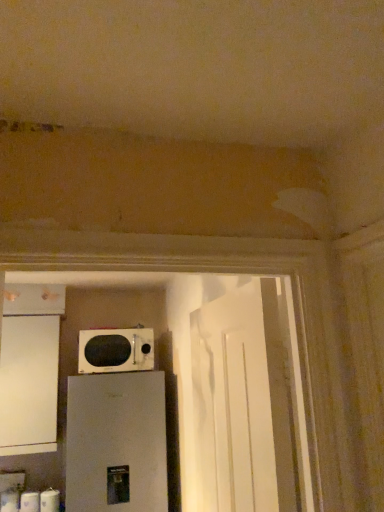
Describe the element at coordinates (30, 368) in the screenshot. This screenshot has width=384, height=512. I see `white matte cabinet at left` at that location.

Identify the location of white matte cabinet at left. This screenshot has height=512, width=384. (30, 368).

What is the approximate height of white matte toilet paper at lower left, the 2th toilet paper in the right-to-left sequence?

white matte toilet paper at lower left, the 2th toilet paper in the right-to-left sequence, is 5.62 inches tall.

Measure the distance between white matte toilet paper at lower left, the 2th toilet paper in the right-to-left sequence, and camera.

They are 2.51 meters apart.

I want to click on white glossy door at center, so click(x=242, y=405).

What are the coordinates of `white matte cabinet at left` in the screenshot? It's located at (30, 368).

Is white matte toilet paper at lower left, which is the second toilet paper in left-to-right order, far away from white glossy door at center?

white matte toilet paper at lower left, which is the second toilet paper in left-to-right order, is positioned a significant distance from white glossy door at center.

Is white matte toilet paper at lower left, the 2th toilet paper in the right-to-left sequence, wider or thinner than white glossy door at center?

In the image, white matte toilet paper at lower left, the 2th toilet paper in the right-to-left sequence, appears to be more narrow than white glossy door at center.

From the image's perspective, which one is positioned higher, white matte toilet paper at lower left, which is the second toilet paper in left-to-right order, or white glossy door at center?

white glossy door at center is shown above in the image.

Does point (30, 499) lie behind point (264, 300)?

Yes, it is.

How different are the orientations of white matte toilet paper at lower left, which is counted as the 1th toilet paper, starting from the right, and white glossy microwave at center in degrees?

white matte toilet paper at lower left, which is counted as the 1th toilet paper, starting from the right, and white glossy microwave at center are facing 9.36 degrees away from each other.

From a real-world perspective, is white matte toilet paper at lower left, which is counted as the 1th toilet paper, starting from the right, under white glossy microwave at center?

Yes, from a real-world perspective, white matte toilet paper at lower left, which is counted as the 1th toilet paper, starting from the right, is beneath white glossy microwave at center.

Is white matte toilet paper at lower left, which is counted as the 1th toilet paper, starting from the right, positioned beyond the bounds of white glossy microwave at center?

Yes, white matte toilet paper at lower left, which is counted as the 1th toilet paper, starting from the right, is located beyond the bounds of white glossy microwave at center.

Is point (57, 492) closer to viewer compared to point (82, 343)?

Yes, it is in front of point (82, 343).

Who is shorter, white matte refrigerator at lower left or white matte toilet paper at lower left, which ranks as the third toilet paper in right-to-left order?

white matte toilet paper at lower left, which ranks as the third toilet paper in right-to-left order, is shorter.

Does white matte refrigerator at lower left have a smaller size compared to white matte toilet paper at lower left, which ranks as the third toilet paper in right-to-left order?

No, white matte refrigerator at lower left is not smaller than white matte toilet paper at lower left, which ranks as the third toilet paper in right-to-left order.

From the image's perspective, who appears lower, white matte refrigerator at lower left or white matte toilet paper at lower left, which is counted as the 1th toilet paper, starting from the left?

From the image's view, white matte toilet paper at lower left, which is counted as the 1th toilet paper, starting from the left, is below.

From the image's perspective, which object appears higher, white matte toilet paper at lower left, the 2th toilet paper in the right-to-left sequence, or white matte toilet paper at lower left, which ranks as the third toilet paper in right-to-left order?

white matte toilet paper at lower left, the 2th toilet paper in the right-to-left sequence.

The image size is (384, 512). What are the coordinates of `toilet paper that is the 2nd one above the white matte toilet paper at lower left, which is the second toilet paper in left-to-right order (from a real-world perspective)` in the screenshot? It's located at (10, 500).

Looking at this image, is white matte toilet paper at lower left, which is the second toilet paper in left-to-right order, facing away from white matte toilet paper at lower left, which ranks as the third toilet paper in right-to-left order?

white matte toilet paper at lower left, which is the second toilet paper in left-to-right order, is not turned away from white matte toilet paper at lower left, which ranks as the third toilet paper in right-to-left order.

Considering the positions of points (6, 340) and (263, 478), is point (6, 340) closer to camera compared to point (263, 478)?

No.

Is white matte cabinet at left aimed at white glossy door at center?

No, white matte cabinet at left is not aimed at white glossy door at center.

From a real-world perspective, relative to white glossy door at center, is white matte cabinet at left vertically above or below?

white matte cabinet at left is situated higher than white glossy door at center in the real world.

From the image's perspective, is white matte cabinet at left below white glossy door at center?

Yes, from the image's perspective, white matte cabinet at left is below white glossy door at center.

From the picture: Are white matte toilet paper at lower left, which is counted as the 1th toilet paper, starting from the right, and white matte cabinet at left making contact?

No, white matte toilet paper at lower left, which is counted as the 1th toilet paper, starting from the right, is not making contact with white matte cabinet at left.

Does point (41, 500) come in front of point (6, 441)?

No.

Is white matte toilet paper at lower left, positioned as the 3th toilet paper in left-to-right order, shorter than white matte cabinet at left?

Correct, white matte toilet paper at lower left, positioned as the 3th toilet paper in left-to-right order, is not as tall as white matte cabinet at left.

From a real-world perspective, which is physically above, white matte toilet paper at lower left, positioned as the 3th toilet paper in left-to-right order, or white matte cabinet at left?

In real-world perspective, white matte cabinet at left is above.

Can you see white glossy microwave at center touching white matte toilet paper at lower left, which is counted as the 1th toilet paper, starting from the left?

No, white glossy microwave at center is not with white matte toilet paper at lower left, which is counted as the 1th toilet paper, starting from the left.

Between white glossy microwave at center and white matte toilet paper at lower left, which ranks as the third toilet paper in right-to-left order, which one has larger size?

Bigger between the two is white glossy microwave at center.

From the image's perspective, is white glossy microwave at center over white matte toilet paper at lower left, which is counted as the 1th toilet paper, starting from the left?

Yes, from the image's perspective, white glossy microwave at center is on top of white matte toilet paper at lower left, which is counted as the 1th toilet paper, starting from the left.

Is white matte toilet paper at lower left, which ranks as the third toilet paper in right-to-left order, inside white glossy microwave at center?

Actually, white matte toilet paper at lower left, which ranks as the third toilet paper in right-to-left order, is outside white glossy microwave at center.

Where is `door located on the right of white matte toilet paper at lower left, which is the second toilet paper in left-to-right order`? door located on the right of white matte toilet paper at lower left, which is the second toilet paper in left-to-right order is located at coordinates (242, 405).

The width and height of the screenshot is (384, 512). In order to click on microwave oven that appears above the white matte toilet paper at lower left, positioned as the 3th toilet paper in left-to-right order (from the image's perspective) in this screenshot , I will do `click(115, 350)`.

When comparing their distances from white matte refrigerator at lower left, does white matte cabinet at left or white matte toilet paper at lower left, which is counted as the 1th toilet paper, starting from the left, seem further?

The object further to white matte refrigerator at lower left is white matte toilet paper at lower left, which is counted as the 1th toilet paper, starting from the left.

Which object lies nearer to the anchor point white glossy door at center, white glossy microwave at center or white matte refrigerator at lower left?

white matte refrigerator at lower left is closer to white glossy door at center.

Estimate the real-world distances between objects in this image. Which object is further from white glossy door at center, white matte toilet paper at lower left, which is counted as the 1th toilet paper, starting from the left, or white matte refrigerator at lower left?

The object further to white glossy door at center is white matte toilet paper at lower left, which is counted as the 1th toilet paper, starting from the left.

Estimate the real-world distances between objects in this image. Which object is closer to white matte cabinet at left, white matte refrigerator at lower left or white matte toilet paper at lower left, the 2th toilet paper in the right-to-left sequence?

The object closer to white matte cabinet at left is white matte refrigerator at lower left.

Estimate the real-world distances between objects in this image. Which object is closer to white matte toilet paper at lower left, which is counted as the 1th toilet paper, starting from the left, white matte refrigerator at lower left or white matte toilet paper at lower left, which is counted as the 1th toilet paper, starting from the right?

white matte toilet paper at lower left, which is counted as the 1th toilet paper, starting from the right.

When comparing their distances from white matte refrigerator at lower left, does white matte toilet paper at lower left, positioned as the 3th toilet paper in left-to-right order, or white matte toilet paper at lower left, which ranks as the third toilet paper in right-to-left order, seem further?

white matte toilet paper at lower left, which ranks as the third toilet paper in right-to-left order, is further to white matte refrigerator at lower left.

Based on their spatial positions, is white matte toilet paper at lower left, positioned as the 3th toilet paper in left-to-right order, or white matte toilet paper at lower left, the 2th toilet paper in the right-to-left sequence, closer to white matte toilet paper at lower left, which is counted as the 1th toilet paper, starting from the left?

The object closer to white matte toilet paper at lower left, which is counted as the 1th toilet paper, starting from the left, is white matte toilet paper at lower left, the 2th toilet paper in the right-to-left sequence.

Based on their spatial positions, is white glossy door at center or white glossy microwave at center further from white matte toilet paper at lower left, positioned as the 3th toilet paper in left-to-right order?

white glossy door at center is further to white matte toilet paper at lower left, positioned as the 3th toilet paper in left-to-right order.

This screenshot has width=384, height=512. In order to click on microwave oven positioned between white glossy door at center and white matte toilet paper at lower left, which ranks as the third toilet paper in right-to-left order, from near to far in this screenshot , I will do `click(115, 350)`.

Find the location of `home appliance located between white glossy door at center and white matte toilet paper at lower left, which is counted as the 1th toilet paper, starting from the right, in the depth direction`. home appliance located between white glossy door at center and white matte toilet paper at lower left, which is counted as the 1th toilet paper, starting from the right, in the depth direction is located at coordinates (116, 443).

The width and height of the screenshot is (384, 512). I want to click on toilet paper that lies between white matte cabinet at left and white matte toilet paper at lower left, the 2th toilet paper in the right-to-left sequence, from top to bottom, so click(x=50, y=500).

Locate an element on the screen. The height and width of the screenshot is (512, 384). home appliance that lies between white glossy microwave at center and white matte toilet paper at lower left, which is counted as the 1th toilet paper, starting from the left, from top to bottom is located at coordinates (116, 443).